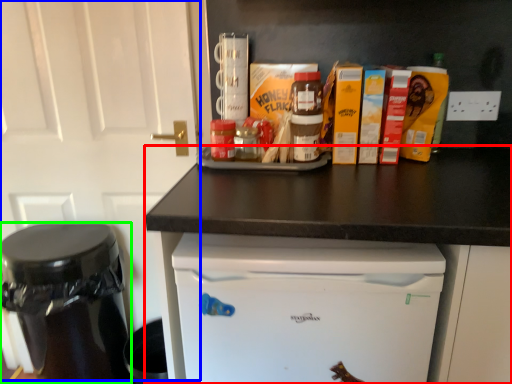
Question: Estimate the real-world distances between objects in this image. Which object is farther from counter (highlighted by a red box), door (highlighted by a blue box) or appliance (highlighted by a green box)?

Choices:
 (A) door
 (B) appliance

Answer: (B)